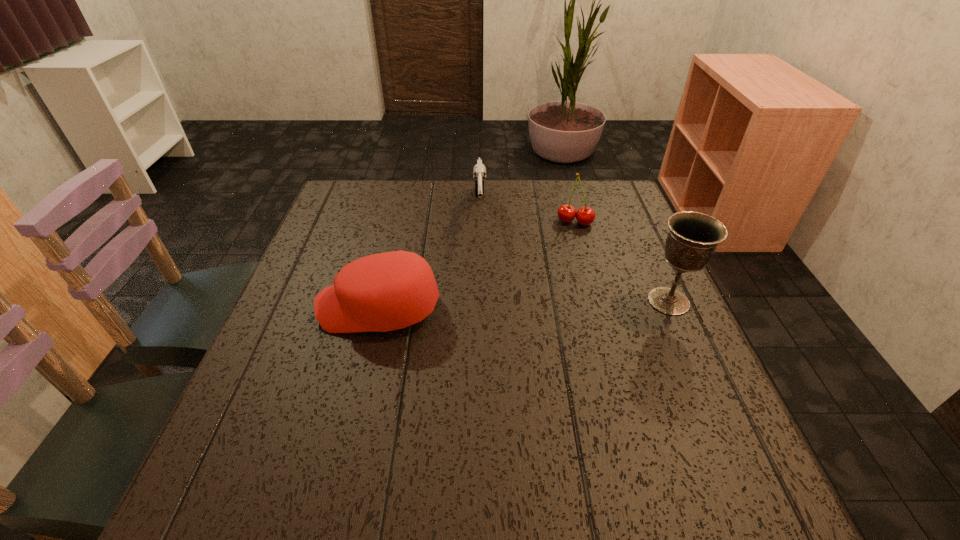
Find the location of a particular element. The image size is (960, 540). free space between the third object from left to right and the leftmost object is located at coordinates (477, 265).

Where is `empty location between the second object from left to right and the rightmost object`? Image resolution: width=960 pixels, height=540 pixels. empty location between the second object from left to right and the rightmost object is located at coordinates (574, 255).

Locate an element on the screen. The width and height of the screenshot is (960, 540). free area in between the leftmost object and the chalice is located at coordinates (524, 305).

The width and height of the screenshot is (960, 540). Find the location of `free spot between the cherry and the third object from right to left`. free spot between the cherry and the third object from right to left is located at coordinates (527, 216).

Identify the location of the second closest object relative to the gun. The image size is (960, 540). (566, 213).

You are a GUI agent. You are given a task and a screenshot of the screen. Output one action in this format:
    pyautogui.click(x=<x>, y=<y>)
    Task: Click on the object that can be found as the closest to the gun
    
    Given the screenshot: What is the action you would take?
    pyautogui.click(x=382, y=292)

Identify the location of vacant region that satisfies the following two spatial constraints: 1. on the front side of the chalice; 2. on the right side of the cherry. (597, 301).